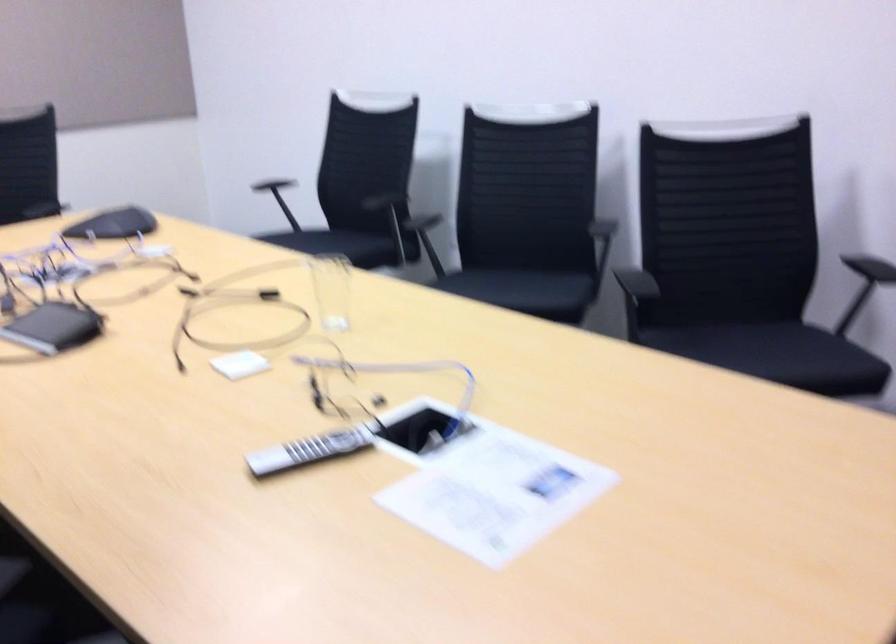
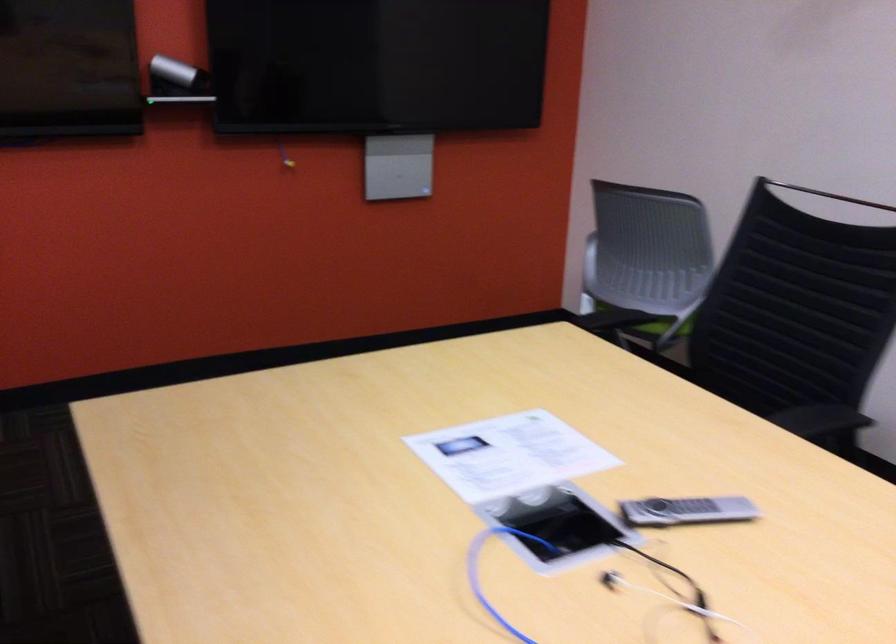
Find the pixel in the second image that matches the point at 297,446 in the first image.

(686, 511)